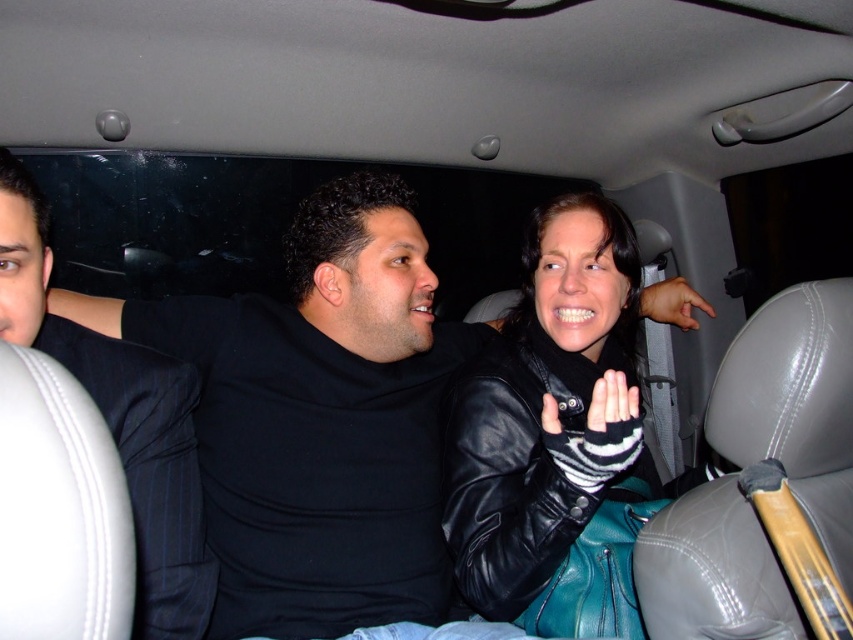
You are standing in the limousine and want to take a photo of the point at coordinate point (590,228). The camera you have can only focus on objects within 1.5 meters. Will the camera be able to focus on the point?

The point at coordinate point (590,228) is 1.44 meters away from the camera, which is within the 1.5 meters focusing range. Therefore, the camera can focus on the point.

You are a photographer inside the limousine. You need to capture a clear photo of the black leather hand at center without the black leather jacket at center blocking it. What should you do?

The black leather jacket at center is in front of the black leather hand at center, so you should move the black leather jacket at center out of the way or adjust your angle to avoid it blocking the view of the black leather hand at center.

You are inside a limousine and need to determine the position of two points marked in the image. Which point is closer to you, point 1 at coordinates point (541, 625) or point 2 at coordinates point (672, 278)?

Point 1 at coordinates point (541, 625) is closer to the viewer than point 2 at coordinates point (672, 278).